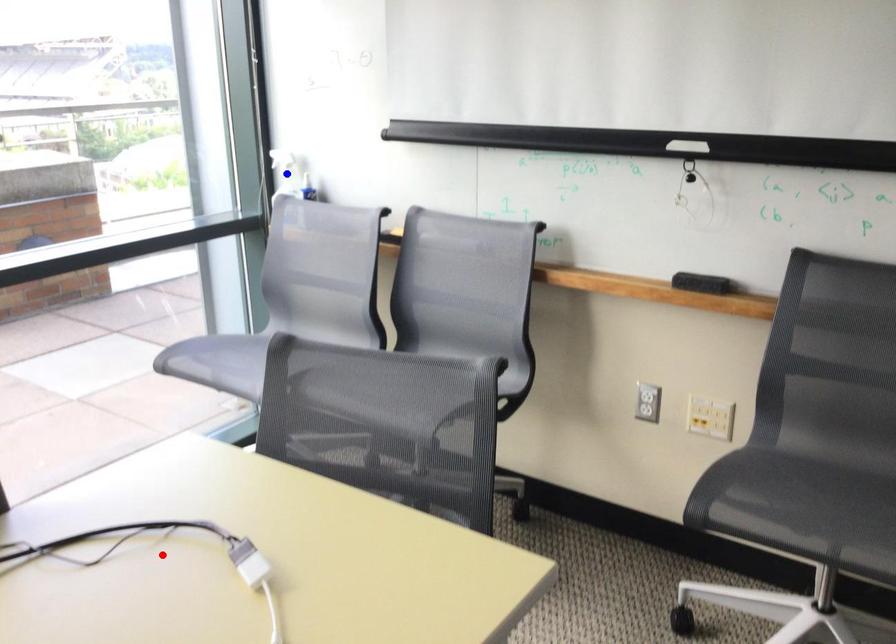
Question: Which of the two points in the image is closer to the camera?

Choices:
 (A) Blue point is closer.
 (B) Red point is closer.

Answer: (B)